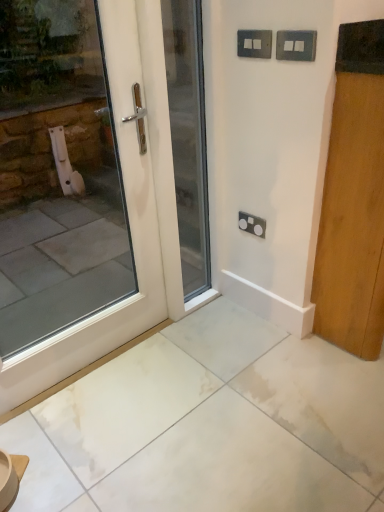
Question: From a real-world perspective, is metallic silver switch at upper center, the 2th electric outlet viewed from the back, beneath satin black socket at center, arranged as the first electric outlet when ordered from the bottom?

Choices:
 (A) yes
 (B) no

Answer: (B)

Question: Is metallic silver switch at upper center, the 2th electric outlet viewed from the back, next to satin black socket at center, which ranks as the third electric outlet in front-to-back order, and touching it?

Choices:
 (A) no
 (B) yes

Answer: (A)

Question: Does metallic silver switch at upper center, the 2th electric outlet viewed from the back, have a greater width compared to satin black socket at center, which ranks as the third electric outlet in front-to-back order?

Choices:
 (A) no
 (B) yes

Answer: (B)

Question: Is metallic silver switch at upper center, which ranks as the 3th electric outlet in bottom-to-top order, taller than satin black socket at center, positioned as the 3th electric outlet in top-to-bottom order?

Choices:
 (A) yes
 (B) no

Answer: (B)

Question: Could you tell me if metallic silver switch at upper center, the second electric outlet viewed from the front, is turned towards satin black socket at center, positioned as the 3th electric outlet in top-to-bottom order?

Choices:
 (A) yes
 (B) no

Answer: (B)

Question: Is metallic silver switch at upper center, which ranks as the 3th electric outlet in bottom-to-top order, positioned behind satin black socket at center, positioned as the 3th electric outlet in top-to-bottom order?

Choices:
 (A) yes
 (B) no

Answer: (B)

Question: Is white glossy door at center, which is the 2th door from right to left, further to camera compared to satin black socket at center, arranged as the first electric outlet when ordered from the bottom?

Choices:
 (A) yes
 (B) no

Answer: (B)

Question: Can you confirm if white glossy door at center, which is the 2th door from right to left, is wider than satin black socket at center, acting as the first electric outlet starting from the back?

Choices:
 (A) yes
 (B) no

Answer: (A)

Question: Considering the relative sizes of white glossy door at center, which is the 2th door from right to left, and satin black socket at center, acting as the first electric outlet starting from the back, in the image provided, is white glossy door at center, which is the 2th door from right to left, taller than satin black socket at center, acting as the first electric outlet starting from the back,?

Choices:
 (A) yes
 (B) no

Answer: (A)

Question: Is white glossy door at center, acting as the second door starting from the left, in front of satin black socket at center, acting as the first electric outlet starting from the back?

Choices:
 (A) yes
 (B) no

Answer: (A)

Question: Is white glossy door at center, acting as the second door starting from the left, to the right of satin black socket at center, acting as the first electric outlet starting from the back, from the viewer's perspective?

Choices:
 (A) no
 (B) yes

Answer: (A)

Question: Considering the relative sizes of white glossy door at center, acting as the second door starting from the left, and satin black socket at center, arranged as the first electric outlet when ordered from the bottom, in the image provided, is white glossy door at center, acting as the second door starting from the left, smaller than satin black socket at center, arranged as the first electric outlet when ordered from the bottom,?

Choices:
 (A) yes
 (B) no

Answer: (B)

Question: Is satin black socket at center, which ranks as the third electric outlet in front-to-back order, outside of wooden door at right, positioned as the 1th door in right-to-left order?

Choices:
 (A) yes
 (B) no

Answer: (A)